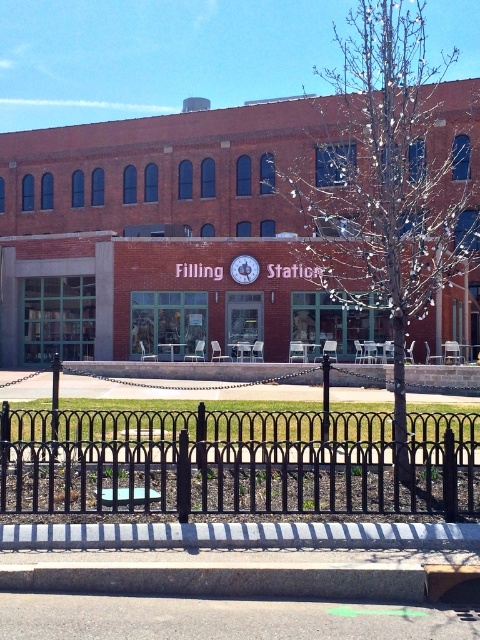
Can you confirm if black wrought iron fence at lower center is shorter than matte silver clock at center?

Answer: Yes.

The width and height of the screenshot is (480, 640). What do you see at coordinates (237, 464) in the screenshot? I see `black wrought iron fence at lower center` at bounding box center [237, 464].

Who is more distant from viewer, (370, 465) or (251, 282)?

The point (251, 282) is more distant.

Image resolution: width=480 pixels, height=640 pixels. I want to click on black wrought iron fence at lower center, so click(237, 464).